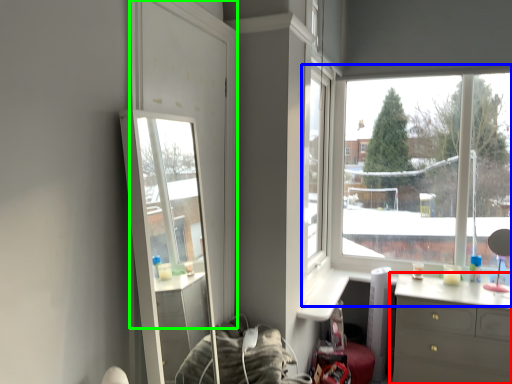
Question: Estimate the real-world distances between objects in this image. Which object is farther from chest of drawers (highlighted by a red box), window (highlighted by a blue box) or glass door (highlighted by a green box)?

Choices:
 (A) window
 (B) glass door

Answer: (B)